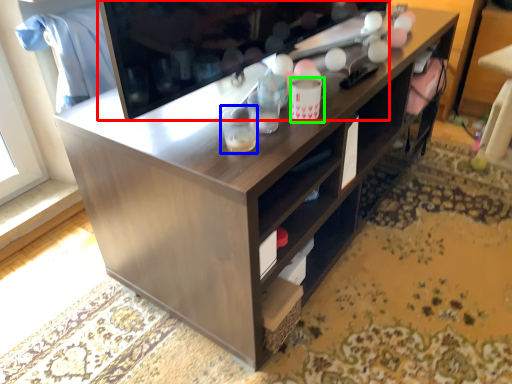
Question: Estimate the real-world distances between objects in this image. Which object is farther from television (highlighted by a red box), beverage (highlighted by a blue box) or beverage (highlighted by a green box)?

Choices:
 (A) beverage
 (B) beverage

Answer: (B)